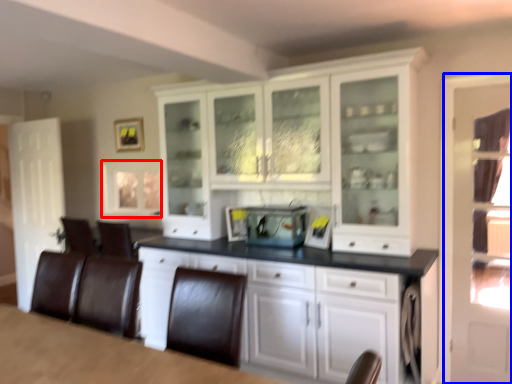
Question: Which of the following is the closest to the observer, window (highlighted by a red box) or glass door (highlighted by a blue box)?

Choices:
 (A) window
 (B) glass door

Answer: (B)